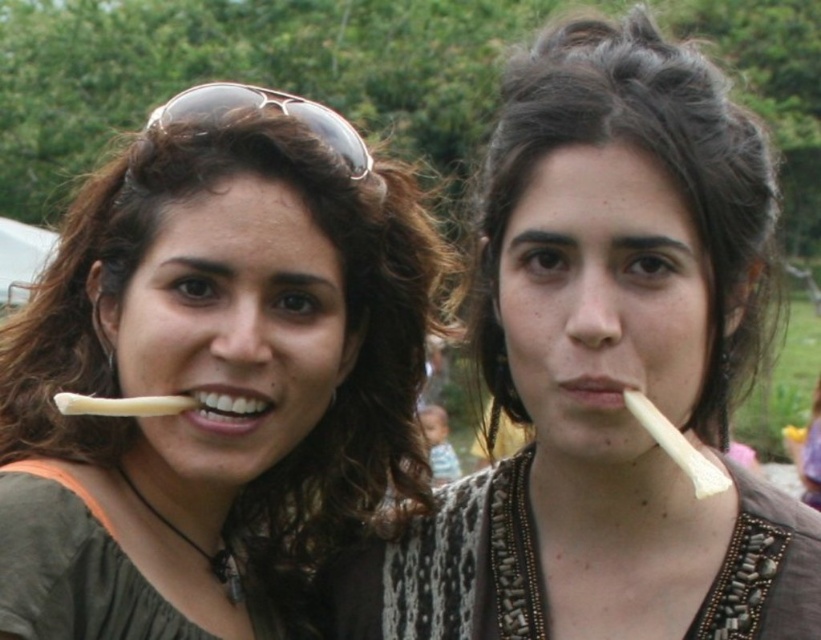
Question: Is smooth beige pipe at center positioned in front of white glossy toothpick at lower left?

Choices:
 (A) no
 (B) yes

Answer: (B)

Question: Based on their relative distances, which object is farther from the matte white bone at left?

Choices:
 (A) white glossy toothpick at lower left
 (B) smooth beige pipe at center

Answer: (B)

Question: Which point appears farthest from the camera in this image?

Choices:
 (A) (579, 92)
 (B) (329, 113)

Answer: (B)

Question: Which object is positioned farthest from the matte white toothpick at center?

Choices:
 (A) smooth beige pipe at center
 (B) matte white bone at left
 (C) brown reflective sunglasses at upper left

Answer: (C)

Question: Does matte white bone at left have a smaller size compared to brown reflective sunglasses at upper left?

Choices:
 (A) no
 (B) yes

Answer: (B)

Question: Where is brown reflective sunglasses at upper left located in relation to matte white toothpick at center in the image?

Choices:
 (A) right
 (B) left

Answer: (B)